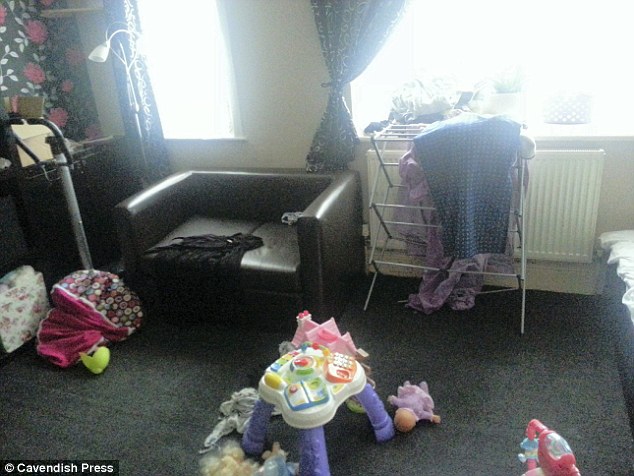
You are a GUI agent. You are given a task and a screenshot of the screen. Output one action in this format:
    pyautogui.click(x=<x>, y=<y>)
    Task: Click on the shelf
    
    Given the screenshot: What is the action you would take?
    (77, 8)